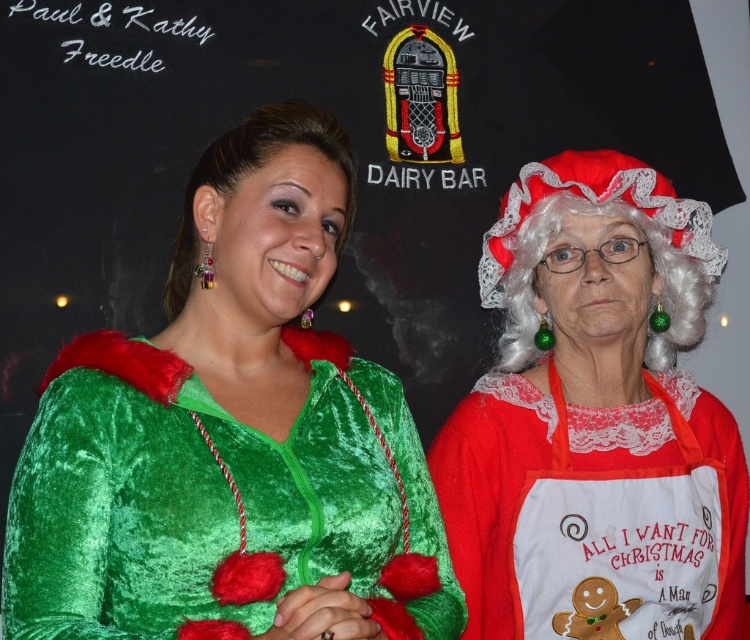
Question: Among these objects, which one is nearest to the camera?

Choices:
 (A) velvet green dress at center
 (B) red velvet santa hat at upper right

Answer: (A)

Question: Is velvet green dress at center closer to camera compared to red velvet santa hat at upper right?

Choices:
 (A) yes
 (B) no

Answer: (A)

Question: Which point is closer to the camera?

Choices:
 (A) (510, 186)
 (B) (660, 561)
 (C) (237, 352)

Answer: (C)

Question: Which point appears farthest from the camera in this image?

Choices:
 (A) (459, 616)
 (B) (687, 573)

Answer: (B)

Question: Is velvet green dress at center smaller than velvet red dress at right?

Choices:
 (A) no
 (B) yes

Answer: (A)

Question: From the image, what is the correct spatial relationship of velvet green dress at center in relation to velvet red dress at right?

Choices:
 (A) above
 (B) below

Answer: (A)